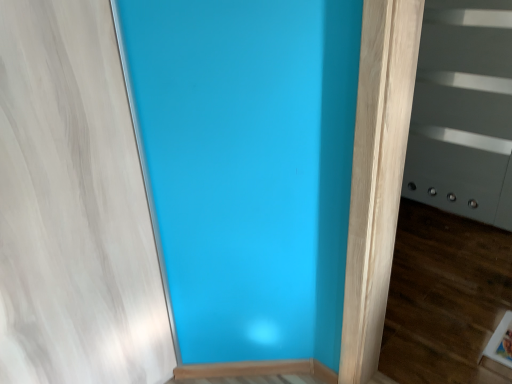
Question: Should I look upward or downward to see satin gray screen door at right?

Choices:
 (A) up
 (B) down

Answer: (A)